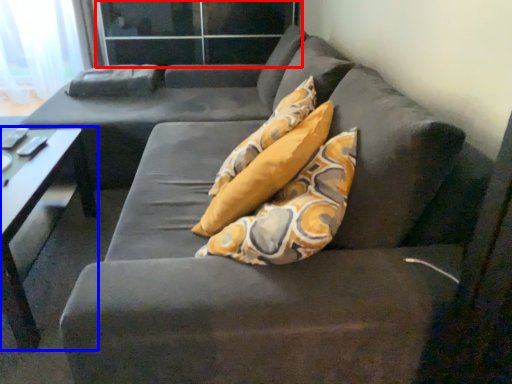
Question: Among these objects, which one is farthest to the camera, glass door (highlighted by a red box) or table (highlighted by a blue box)?

Choices:
 (A) glass door
 (B) table

Answer: (A)